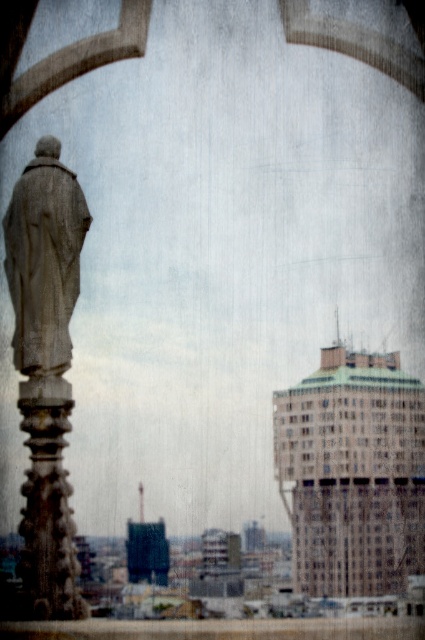
Question: Can you confirm if stone statue at left is positioned to the right of carved stone pillar at left?

Choices:
 (A) yes
 (B) no

Answer: (B)

Question: Which point is closer to the camera taking this photo?

Choices:
 (A) click(5, 221)
 (B) click(23, 509)
 (C) click(62, 531)

Answer: (C)

Question: Which object is closer to the camera taking this photo?

Choices:
 (A) carved stone pillar at left
 (B) gray stone statue at left

Answer: (A)

Question: Which of these objects is positioned closest to the gray stone statue at left?

Choices:
 (A) stone statue at left
 (B) carved stone pillar at left

Answer: (A)

Question: Is gray stone statue at left to the left of carved stone pillar at left from the viewer's perspective?

Choices:
 (A) no
 (B) yes

Answer: (B)

Question: In this image, where is stone statue at left located relative to gray stone statue at left?

Choices:
 (A) left
 (B) right

Answer: (B)